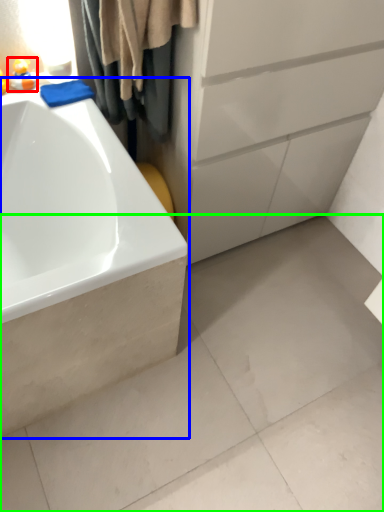
Question: Which is nearer to the toy (highlighted by a red box)? bathtub (highlighted by a blue box) or concrete (highlighted by a green box).

Choices:
 (A) bathtub
 (B) concrete

Answer: (A)